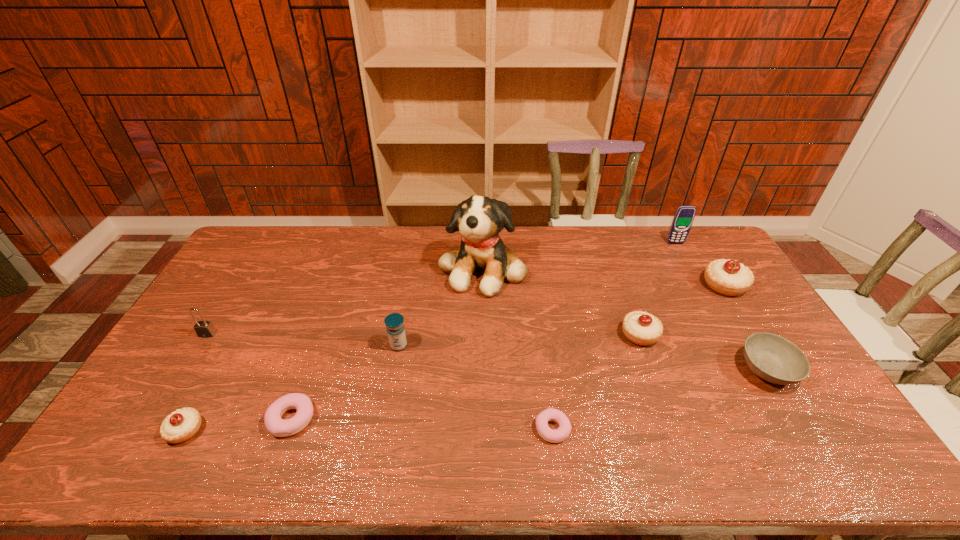
Locate an element on the screen. The width and height of the screenshot is (960, 540). the fourth closest pastry relative to the padlock is located at coordinates (641, 328).

This screenshot has width=960, height=540. Find the location of `the closest pastry to the rightmost pastry`. the closest pastry to the rightmost pastry is located at coordinates (641, 328).

Locate an element on the screen. beige pastry identified as the closest to the tallest object is located at coordinates (641, 328).

This screenshot has height=540, width=960. I want to click on beige pastry that is the third closest to the fourth object from left to right, so click(727, 277).

What are the coordinates of `vacant space that satisfies the following two spatial constraints: 1. on the back side of the left pink pastry; 2. on the right side of the sixth tallest object` in the screenshot? It's located at (323, 334).

Identify the location of vacant space that satisfies the following two spatial constraints: 1. on the front-facing side of the bowl; 2. on the right side of the cellular telephone. This screenshot has width=960, height=540. (746, 370).

Identify the location of vacant space that satisfies the following two spatial constraints: 1. on the shackle of the padlock; 2. on the left side of the bigger pink pastry. The image size is (960, 540). (156, 419).

At what (x,y) coordinates should I click in order to perform the action: click on vacant space that satisfies the following two spatial constraints: 1. at the face of the tallest object; 2. on the left side of the shortest pastry. Please return your answer as a coordinate pair (x, y). Looking at the image, I should click on (484, 429).